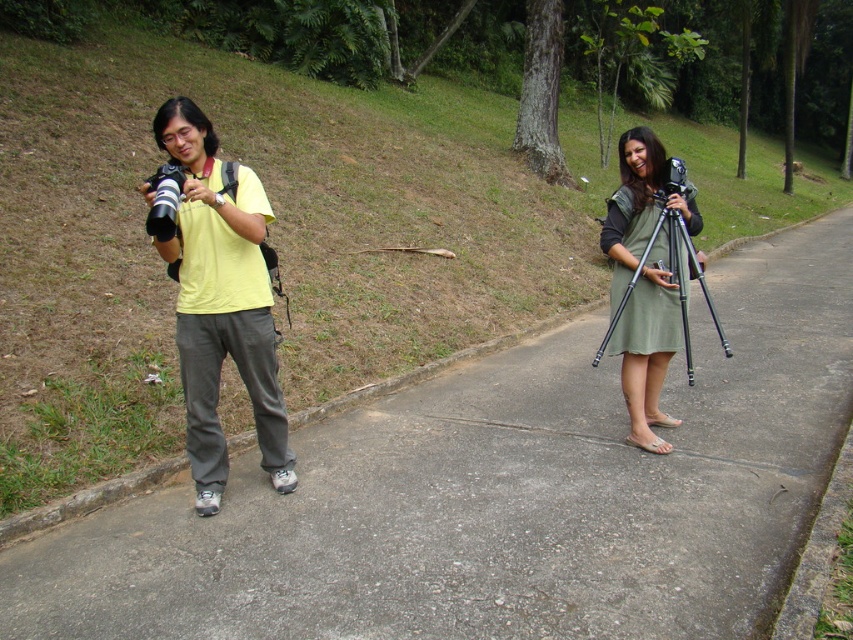
Which of these two, yellow matte shirt at left or matte black camera at left, stands shorter?

matte black camera at left is shorter.

Does yellow matte shirt at left appear under matte black camera at left?

Indeed, yellow matte shirt at left is positioned under matte black camera at left.

Is point (247, 310) behind point (172, 184)?

Yes, point (247, 310) is behind point (172, 184).

Where is `yellow matte shirt at left`? The width and height of the screenshot is (853, 640). yellow matte shirt at left is located at coordinates (221, 304).

Is gray concrete pavement at center to the right of black matte tripod at right from the viewer's perspective?

Correct, you'll find gray concrete pavement at center to the right of black matte tripod at right.

Who is lower down, gray concrete pavement at center or black matte tripod at right?

Positioned lower is gray concrete pavement at center.

What do you see at coordinates (503, 493) in the screenshot? Image resolution: width=853 pixels, height=640 pixels. I see `gray concrete pavement at center` at bounding box center [503, 493].

I want to click on gray concrete pavement at center, so [503, 493].

Who is taller, black matte tripod at right or matte black camera at left?

Standing taller between the two is black matte tripod at right.

Can you confirm if black matte tripod at right is thinner than matte black camera at left?

Incorrect, black matte tripod at right's width is not less than matte black camera at left's.

Which is behind, point (659, 218) or point (149, 227)?

Point (659, 218)

This screenshot has width=853, height=640. What are the coordinates of `black matte tripod at right` in the screenshot? It's located at (643, 266).